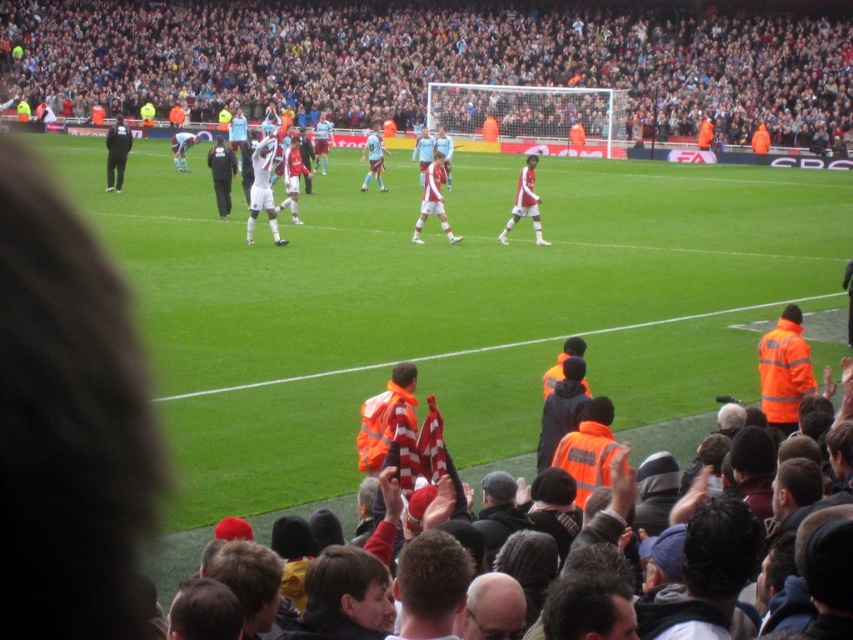
You are a photographer at the soccer stadium. You want to capture a photo that includes both the dark gray crowd at upper center and the light blue jersey at center. Which object should you zoom in on to ensure both are visible in the frame?

The dark gray crowd at upper center is wider than the light blue jersey at center, so you should zoom in on the dark gray crowd at upper center to ensure both are visible in the frame.

In the soccer stadium scene, there is a player wearing matte white shorts at center. Where exactly is this player located on the field?

The matte white shorts at center is located at point coordinates of (434,198).